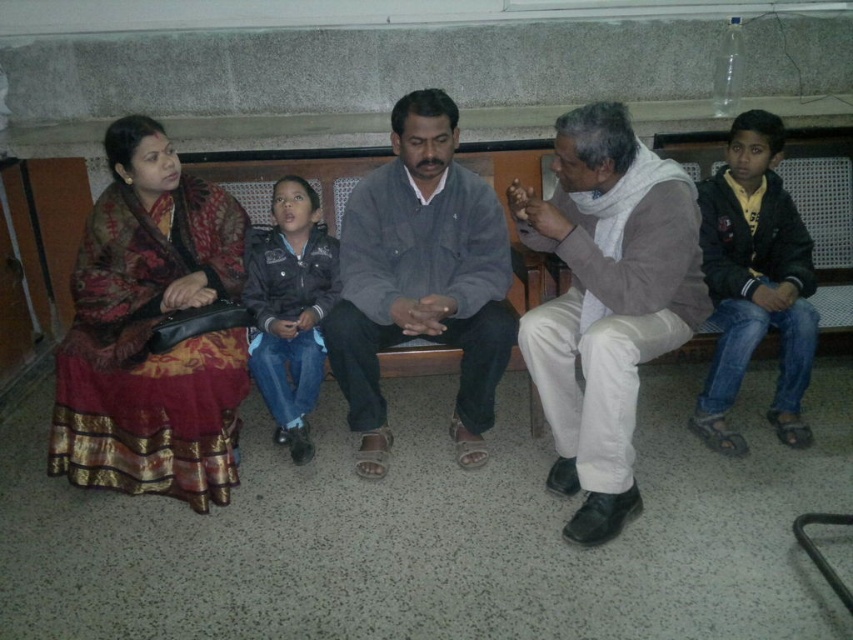
Question: Which point is farther to the camera?

Choices:
 (A) (596, 312)
 (B) (155, 193)
 (C) (802, 310)
 (D) (402, 144)

Answer: (B)

Question: Is reddish-brown silk saree at left positioned at the back of gray cotton shirt at center?

Choices:
 (A) no
 (B) yes

Answer: (B)

Question: Does white cotton scarf at center appear on the left side of gray cotton shirt at center?

Choices:
 (A) no
 (B) yes

Answer: (A)

Question: Is the position of reddish-brown silk saree at left less distant than that of white cotton scarf at center?

Choices:
 (A) yes
 (B) no

Answer: (B)

Question: Which point is farther to the camera?

Choices:
 (A) reddish-brown silk saree at left
 (B) gray cotton shirt at center
 (C) white cotton scarf at center

Answer: (A)

Question: Which point is closer to the camera?

Choices:
 (A) (102, 301)
 (B) (601, 209)
 (C) (703, 406)

Answer: (B)